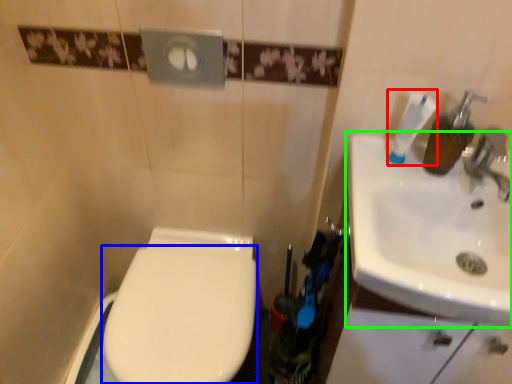
Question: Estimate the real-world distances between objects in this image. Which object is closer to toothpaste (highlighted by a red box), bidet (highlighted by a blue box) or sink (highlighted by a green box)?

Choices:
 (A) bidet
 (B) sink

Answer: (B)